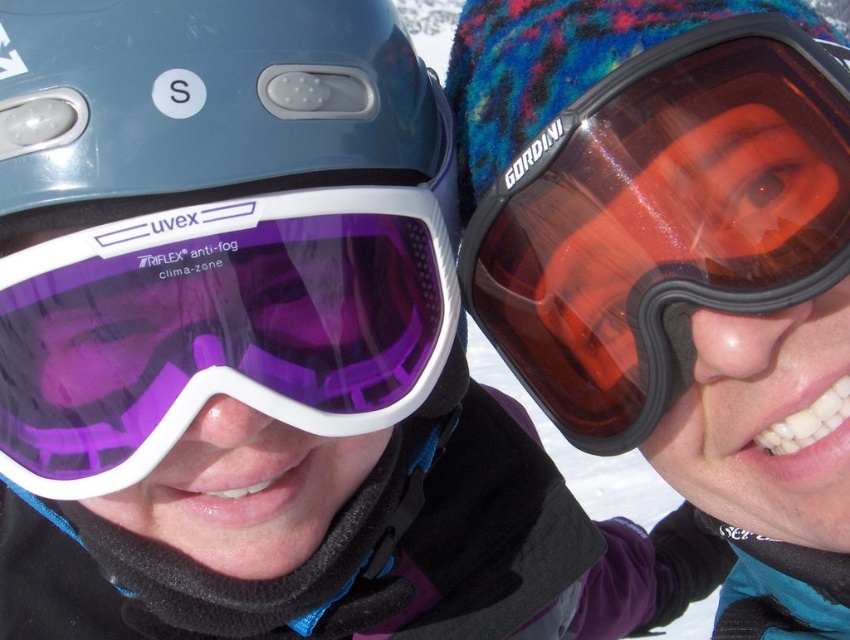
Measure the distance between translucent amber lens goggles at right and purple matte ski goggles at left.

9.37 inches

Does translucent amber lens goggles at right lie behind purple matte ski goggles at left?

Yes, it is behind purple matte ski goggles at left.

Looking at this image, who is more forward, [466,269] or [303,385]?

Point [303,385]

Locate an element on the screen. The image size is (850, 640). translucent amber lens goggles at right is located at coordinates (655, 216).